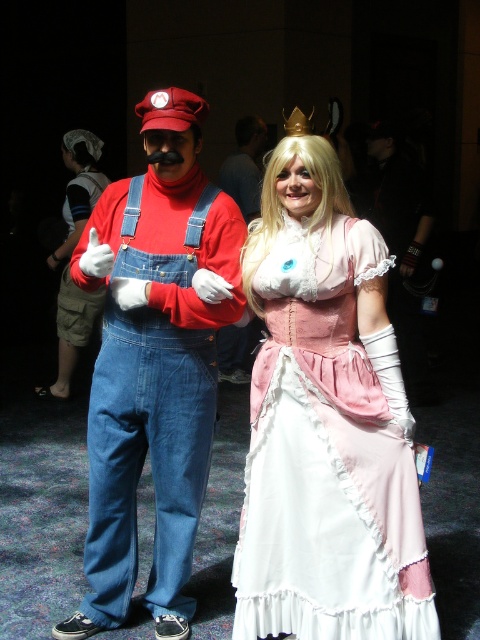
In the image, there are two costumed individuals. The first is dressed as Mario, and the second as Princess Peach. There is a point marked at coordinates [328,456]. Which costumed character is closer to this point?

The point at [328,456] marks the pink satin dress at center, which belongs to Princess Peach. Therefore, the Princess Peach costume is closer to this point.

You are a photographer setting up for a photoshoot and need to decide where to place the two main subjects. The scene has a pink satin dress at center and matte denim overalls at left. Which subject should you move closer to the camera to ensure both are in focus, considering their sizes?

The pink satin dress at center is thinner than the matte denim overalls at left, so moving the pink satin dress at center closer to the camera will help ensure both are in focus by balancing their sizes in the frame.